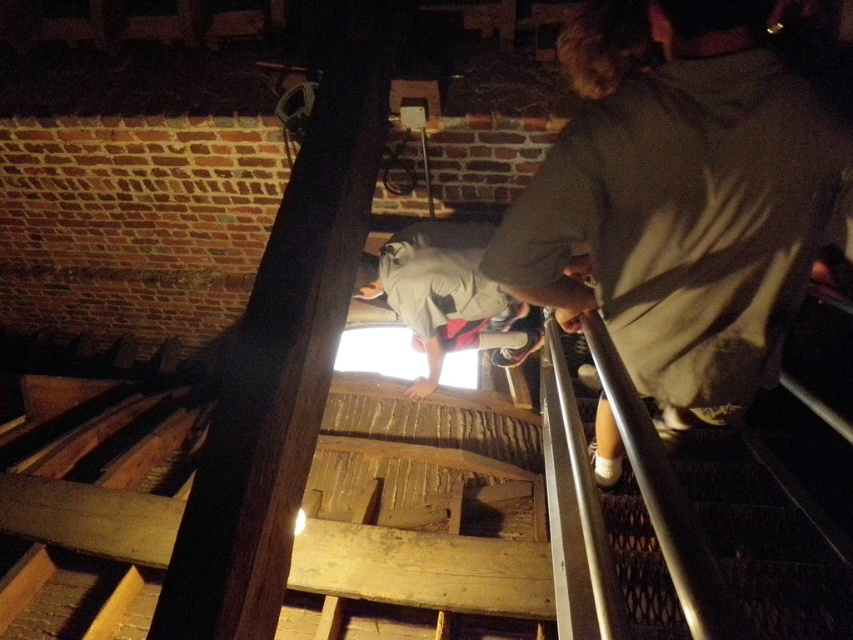
You are a tour guide leading a group through this historical site. Two tourists, one wearing a dark brown shirt at center, are standing in the scene. You need to hand out a map to both tourists. Can you reach both tourists without moving from your current position if you can extend your arms 1.2 meters?

The two tourists are 1.31 meters apart. Since your arms can only reach 1.2 meters, you cannot reach both tourists at the same time without moving.

Looking at this image, you are a night security guard patrolling the area. You notice the dark brown shirt at center and the dark wood beam at center. Which object is closer to you?

The dark brown shirt at center is closer to you since it is in front of the dark wood beam at center.

You are a tour guide leading a group at night. You notice two visitors, the dark brown shirt at center and the gray fabric shirt at center, standing near each other. You need to ensure they are at least 5 feet apart for safety. Are they within the required distance?

The dark brown shirt at center is 4.93 feet from the gray fabric shirt at center, which is slightly less than the required 5 feet. They are too close and need to move farther apart for safety.